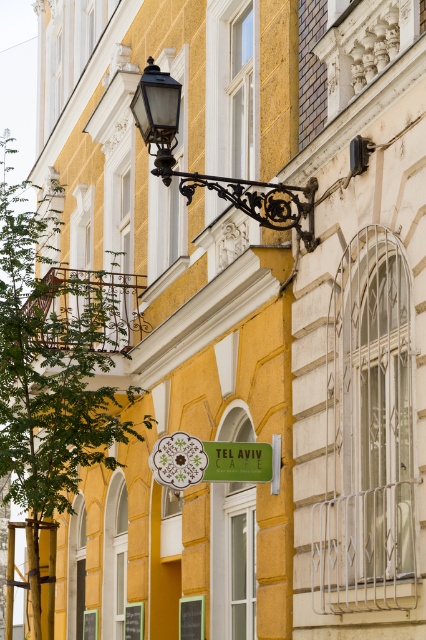
Question: Among these points, which one is farthest from the camera?

Choices:
 (A) (229, 474)
 (B) (161, 161)

Answer: (A)

Question: Which point is farther to the camera?

Choices:
 (A) (164, 164)
 (B) (210, 477)

Answer: (B)

Question: Does matte black lamp at upper left have a lesser width compared to green matte signboard at center?

Choices:
 (A) yes
 (B) no

Answer: (B)

Question: Is matte black lamp at upper left positioned in front of green matte signboard at center?

Choices:
 (A) yes
 (B) no

Answer: (A)

Question: Does matte black lamp at upper left appear on the left side of green matte signboard at center?

Choices:
 (A) no
 (B) yes

Answer: (A)